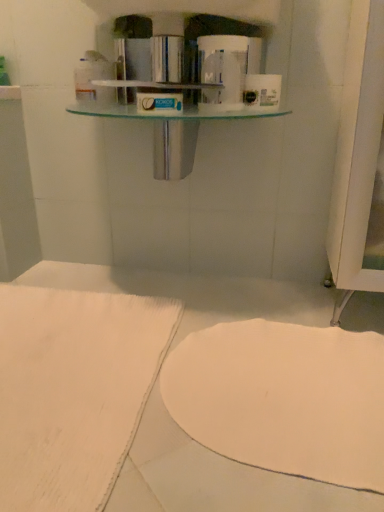
Question: Can you confirm if white glossy toilet paper at upper center, which is the second toilet paper from right to left, is shorter than white matte towel at lower center?

Choices:
 (A) no
 (B) yes

Answer: (A)

Question: Considering the relative sizes of white glossy toilet paper at upper center, placed as the 1th toilet paper when sorted from left to right, and white matte towel at lower center in the image provided, is white glossy toilet paper at upper center, placed as the 1th toilet paper when sorted from left to right, taller than white matte towel at lower center?

Choices:
 (A) no
 (B) yes

Answer: (B)

Question: Considering the relative sizes of white glossy toilet paper at upper center, placed as the 1th toilet paper when sorted from left to right, and white matte towel at lower center in the image provided, is white glossy toilet paper at upper center, placed as the 1th toilet paper when sorted from left to right, thinner than white matte towel at lower center?

Choices:
 (A) yes
 (B) no

Answer: (A)

Question: From the image's perspective, is white glossy toilet paper at upper center, placed as the 1th toilet paper when sorted from left to right, beneath white matte towel at lower center?

Choices:
 (A) no
 (B) yes

Answer: (A)

Question: Would you say white glossy toilet paper at upper center, which is the second toilet paper from right to left, contains white matte towel at lower center?

Choices:
 (A) yes
 (B) no

Answer: (B)

Question: Does white glossy toilet paper at upper center, which is the second toilet paper from right to left, turn towards white matte towel at lower center?

Choices:
 (A) no
 (B) yes

Answer: (A)

Question: Is white matte toilet paper at upper center, the 2th toilet paper in the left-to-right sequence, to the left of white fabric at lower left from the viewer's perspective?

Choices:
 (A) yes
 (B) no

Answer: (B)

Question: Considering the relative sizes of white matte toilet paper at upper center, the 2th toilet paper in the left-to-right sequence, and white fabric at lower left in the image provided, is white matte toilet paper at upper center, the 2th toilet paper in the left-to-right sequence, smaller than white fabric at lower left?

Choices:
 (A) no
 (B) yes

Answer: (B)

Question: Can you confirm if white matte toilet paper at upper center, the 2th toilet paper in the left-to-right sequence, is shorter than white fabric at lower left?

Choices:
 (A) yes
 (B) no

Answer: (B)

Question: Is white fabric at lower left completely or partially inside white matte toilet paper at upper center, the 1th toilet paper from the right?

Choices:
 (A) no
 (B) yes

Answer: (A)

Question: From the image's perspective, is white matte toilet paper at upper center, the 1th toilet paper from the right, under white fabric at lower left?

Choices:
 (A) no
 (B) yes

Answer: (A)

Question: Is white matte toilet paper at upper center, the 2th toilet paper in the left-to-right sequence, aimed at white fabric at lower left?

Choices:
 (A) yes
 (B) no

Answer: (B)

Question: Is white glossy toilet paper at upper center, which is the second toilet paper from right to left, with white fabric at lower left?

Choices:
 (A) yes
 (B) no

Answer: (B)